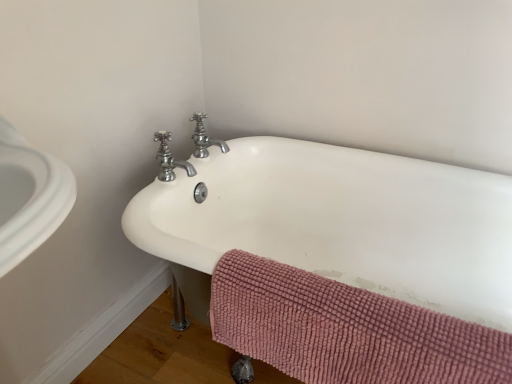
What is the approximate height of white ceramic bathtub at center?

white ceramic bathtub at center is 59.60 centimeters tall.

Describe the element at coordinates (337, 223) in the screenshot. The height and width of the screenshot is (384, 512). I see `white ceramic bathtub at center` at that location.

What do you see at coordinates (169, 159) in the screenshot?
I see `polished chrome faucet at upper center, arranged as the second tap when viewed from the back` at bounding box center [169, 159].

You are a GUI agent. You are given a task and a screenshot of the screen. Output one action in this format:
    pyautogui.click(x=<x>, y=<y>)
    Task: Click on the polished chrome faucet at upper center, which appears as the 1th tap when viewed from the back
    The image size is (512, 384).
    Given the screenshot: What is the action you would take?
    pyautogui.click(x=204, y=138)

Where is `white ceramic bathtub at center`? This screenshot has height=384, width=512. white ceramic bathtub at center is located at coordinates (337, 223).

Which of these two, polished chrome faucet at upper center, the second tap when ordered from front to back, or white ceramic bathtub at center, stands shorter?

polished chrome faucet at upper center, the second tap when ordered from front to back.

From a real-world perspective, is polished chrome faucet at upper center, which appears as the 1th tap when viewed from the back, beneath white ceramic bathtub at center?

Actually, polished chrome faucet at upper center, which appears as the 1th tap when viewed from the back, is physically above white ceramic bathtub at center in the real world.

Measure the distance from polished chrome faucet at upper center, which appears as the 1th tap when viewed from the back, to white ceramic bathtub at center.

polished chrome faucet at upper center, which appears as the 1th tap when viewed from the back, is 16.87 inches from white ceramic bathtub at center.

Considering the relative positions of polished chrome faucet at upper center, the second tap when ordered from front to back, and white ceramic bathtub at center in the image provided, is polished chrome faucet at upper center, the second tap when ordered from front to back, behind white ceramic bathtub at center?

That is True.

From the image's perspective, which is above, white ceramic bathtub at center or pink chenille bath towel at lower right?

white ceramic bathtub at center.

Based on the photo, does white ceramic bathtub at center have a larger size compared to pink chenille bath towel at lower right?

Indeed, white ceramic bathtub at center has a larger size compared to pink chenille bath towel at lower right.

Measure the distance between white ceramic bathtub at center and pink chenille bath towel at lower right.

16.57 inches.

This screenshot has height=384, width=512. I want to click on bathtub above the pink chenille bath towel at lower right (from the image's perspective), so tap(337, 223).

Between white ceramic bathtub at center and polished chrome faucet at upper center, arranged as the second tap when viewed from the back, which one has less height?

Standing shorter between the two is polished chrome faucet at upper center, arranged as the second tap when viewed from the back.

How different are the orientations of white ceramic bathtub at center and polished chrome faucet at upper center, which ranks as the 1th tap in front-to-back order, in degrees?

87.8 degrees separate the facing orientations of white ceramic bathtub at center and polished chrome faucet at upper center, which ranks as the 1th tap in front-to-back order.

Is white ceramic bathtub at center touching polished chrome faucet at upper center, arranged as the second tap when viewed from the back?

No.

How many degrees apart are the facing directions of polished chrome faucet at upper center, which appears as the 1th tap when viewed from the back, and pink chenille bath towel at lower right?

88 degrees.

Which of these two, polished chrome faucet at upper center, which appears as the 1th tap when viewed from the back, or pink chenille bath towel at lower right, stands shorter?

polished chrome faucet at upper center, which appears as the 1th tap when viewed from the back.

Could you tell me if polished chrome faucet at upper center, which appears as the 1th tap when viewed from the back, is facing pink chenille bath towel at lower right?

No.

Is polished chrome faucet at upper center, the second tap when ordered from front to back, further to camera compared to pink chenille bath towel at lower right?

Yes, polished chrome faucet at upper center, the second tap when ordered from front to back, is behind pink chenille bath towel at lower right.

Between point (163, 139) and point (413, 213), which one is positioned in front?

Positioned in front is point (163, 139).

Considering the sizes of objects polished chrome faucet at upper center, which ranks as the 1th tap in front-to-back order, and white ceramic bathtub at center in the image provided, who is shorter, polished chrome faucet at upper center, which ranks as the 1th tap in front-to-back order, or white ceramic bathtub at center?

polished chrome faucet at upper center, which ranks as the 1th tap in front-to-back order.

How many degrees apart are the facing directions of polished chrome faucet at upper center, which ranks as the 1th tap in front-to-back order, and white ceramic bathtub at center?

The angle between the facing direction of polished chrome faucet at upper center, which ranks as the 1th tap in front-to-back order, and the facing direction of white ceramic bathtub at center is 87.8 degrees.

From a real-world perspective, is pink chenille bath towel at lower right below polished chrome faucet at upper center, the second tap when ordered from front to back?

Indeed, from a real-world perspective, pink chenille bath towel at lower right is positioned beneath polished chrome faucet at upper center, the second tap when ordered from front to back.

This screenshot has height=384, width=512. Identify the location of bath towel on the right of polished chrome faucet at upper center, the second tap when ordered from front to back. (344, 330).

From the image's perspective, which is above, pink chenille bath towel at lower right or polished chrome faucet at upper center, the second tap when ordered from front to back?

polished chrome faucet at upper center, the second tap when ordered from front to back, appears higher in the image.

Does pink chenille bath towel at lower right turn towards polished chrome faucet at upper center, which appears as the 1th tap when viewed from the back?

No, pink chenille bath towel at lower right is not facing towards polished chrome faucet at upper center, which appears as the 1th tap when viewed from the back.

Who is shorter, pink chenille bath towel at lower right or white ceramic bathtub at center?

pink chenille bath towel at lower right is shorter.

Is the surface of pink chenille bath towel at lower right in direct contact with white ceramic bathtub at center?

No, pink chenille bath towel at lower right is not beside white ceramic bathtub at center.

Is point (326, 314) closer to camera compared to point (268, 243)?

Yes, point (326, 314) is closer to viewer.

Identify the location of bathtub located on the right of polished chrome faucet at upper center, which appears as the 1th tap when viewed from the back. point(337,223).

Find the location of a particular element. The width and height of the screenshot is (512, 384). bathtub above the pink chenille bath towel at lower right (from the image's perspective) is located at coordinates (337, 223).

Considering their positions, is polished chrome faucet at upper center, the second tap when ordered from front to back, positioned further to polished chrome faucet at upper center, arranged as the second tap when viewed from the back, than white ceramic bathtub at center?

white ceramic bathtub at center is positioned further to the anchor polished chrome faucet at upper center, arranged as the second tap when viewed from the back.

When comparing their distances from white ceramic bathtub at center, does polished chrome faucet at upper center, arranged as the second tap when viewed from the back, or polished chrome faucet at upper center, the second tap when ordered from front to back, seem further?

Based on the image, polished chrome faucet at upper center, arranged as the second tap when viewed from the back, appears to be further to white ceramic bathtub at center.

Based on their spatial positions, is polished chrome faucet at upper center, which ranks as the 1th tap in front-to-back order, or white ceramic bathtub at center further from polished chrome faucet at upper center, the second tap when ordered from front to back?

Among the two, white ceramic bathtub at center is located further to polished chrome faucet at upper center, the second tap when ordered from front to back.

When comparing their distances from white ceramic bathtub at center, does polished chrome faucet at upper center, the second tap when ordered from front to back, or polished chrome faucet at upper center, which ranks as the 1th tap in front-to-back order, seem closer?

Among the two, polished chrome faucet at upper center, the second tap when ordered from front to back, is located nearer to white ceramic bathtub at center.

When comparing their distances from pink chenille bath towel at lower right, does white ceramic bathtub at center or polished chrome faucet at upper center, arranged as the second tap when viewed from the back, seem closer?

white ceramic bathtub at center is positioned closer to the anchor pink chenille bath towel at lower right.

In the scene shown: When comparing their distances from pink chenille bath towel at lower right, does white ceramic bathtub at center or polished chrome faucet at upper center, which appears as the 1th tap when viewed from the back, seem closer?

Among the two, white ceramic bathtub at center is located nearer to pink chenille bath towel at lower right.

Which object lies nearer to the anchor point white ceramic bathtub at center, polished chrome faucet at upper center, which appears as the 1th tap when viewed from the back, or pink chenille bath towel at lower right?

pink chenille bath towel at lower right is positioned closer to the anchor white ceramic bathtub at center.

Looking at the image, which one is located further to white ceramic bathtub at center, pink chenille bath towel at lower right or polished chrome faucet at upper center, arranged as the second tap when viewed from the back?

polished chrome faucet at upper center, arranged as the second tap when viewed from the back, is positioned further to the anchor white ceramic bathtub at center.

I want to click on bath towel between white ceramic bathtub at center and polished chrome faucet at upper center, arranged as the second tap when viewed from the back, along the z-axis, so click(x=344, y=330).

The image size is (512, 384). I want to click on tap between white ceramic bathtub at center and polished chrome faucet at upper center, which appears as the 1th tap when viewed from the back, along the z-axis, so click(x=169, y=159).

I want to click on tap located between pink chenille bath towel at lower right and polished chrome faucet at upper center, the second tap when ordered from front to back, in the depth direction, so click(x=169, y=159).

The width and height of the screenshot is (512, 384). Find the location of `bath towel between white ceramic bathtub at center and polished chrome faucet at upper center, which appears as the 1th tap when viewed from the back, from front to back`. bath towel between white ceramic bathtub at center and polished chrome faucet at upper center, which appears as the 1th tap when viewed from the back, from front to back is located at coordinates (344, 330).